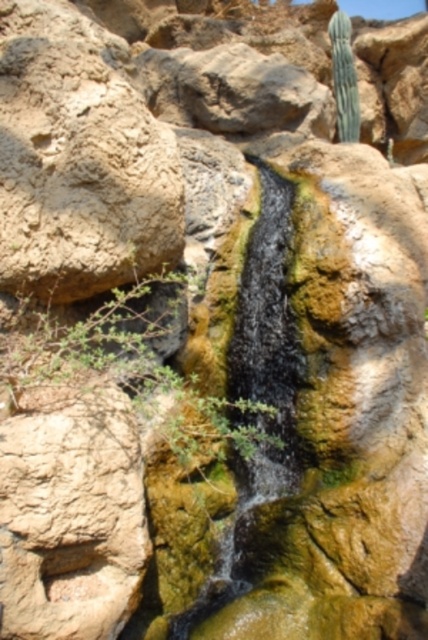
You are a hiker who wants to take a photo of the green leafy shrub at center and the green spiky cactus at upper right. Which one should you focus on first if you want to capture both in the same frame?

The green leafy shrub at center is shorter than the green spiky cactus at upper right, so you should focus on the green spiky cactus at upper right first to ensure both are in the same frame.

You are a hiker who wants to take a photo of the green leafy shrub at center and the green spiky cactus at upper right. Which object should you focus on first if you want both to be in focus?

The green leafy shrub at center is positioned under the green spiky cactus at upper right, so you should focus on the green spiky cactus at upper right first to ensure both are in focus.